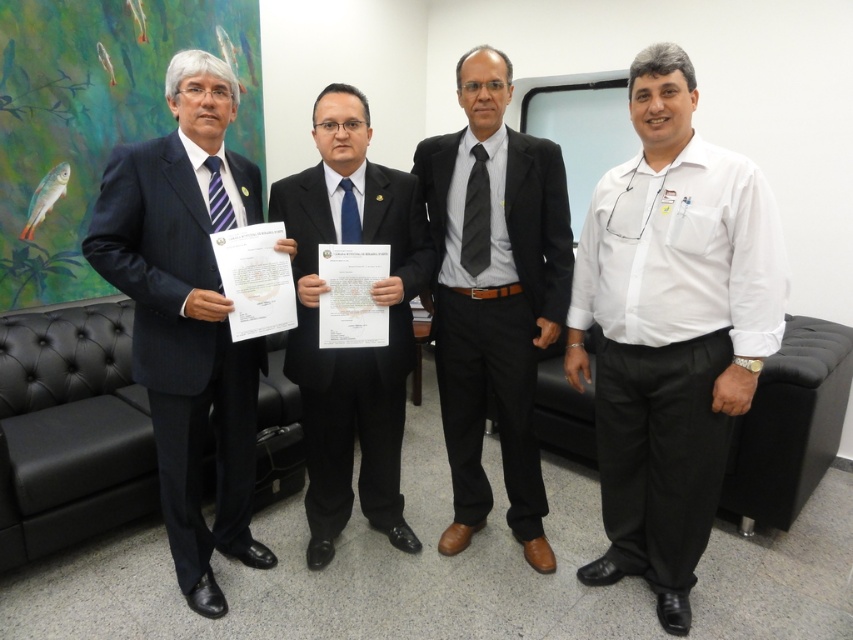
Is point (165, 145) closer to viewer compared to point (314, 225)?

Yes, point (165, 145) is closer to viewer.

Who is positioned more to the left, matte black suit at left or black suit at center?

From the viewer's perspective, matte black suit at left appears more on the left side.

In order to click on matte black suit at left in this screenshot , I will do `click(187, 317)`.

Between point (462, 230) and point (341, 211), which one is positioned in front?

Point (341, 211)

Who is more distant from viewer, (x=486, y=172) or (x=358, y=232)?

The point (x=486, y=172) is more distant.

Which is behind, point (488, 188) or point (346, 211)?

The point (488, 188) is more distant.

Locate an element on the screen. The image size is (853, 640). black striped tie at center is located at coordinates (476, 216).

Consider the image. Can you confirm if white cotton shirt at right is shorter than blue silk tie at center?

No.

The height and width of the screenshot is (640, 853). Identify the location of white cotton shirt at right. (671, 330).

Where is `white cotton shirt at right`? white cotton shirt at right is located at coordinates (671, 330).